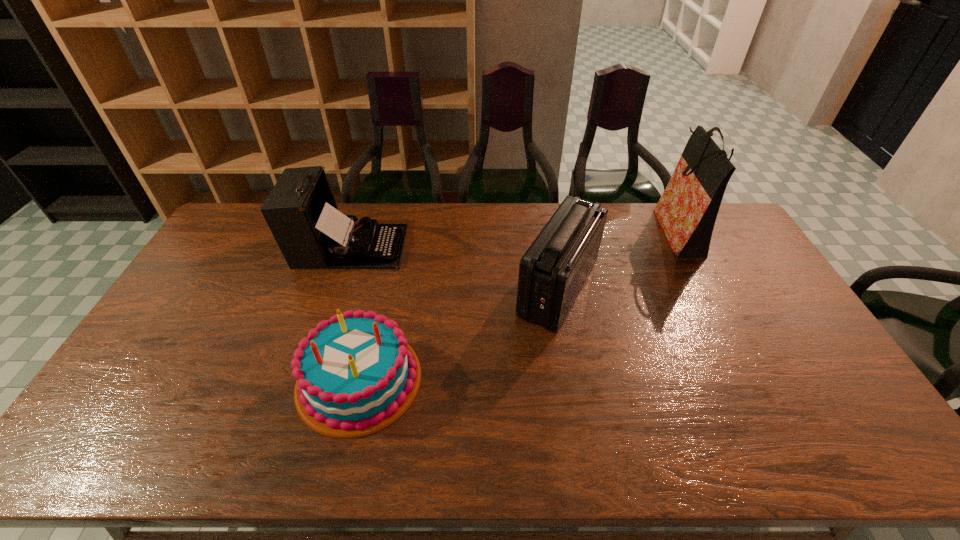
Where is `free space that satisfies the following two spatial constraints: 1. on the front panel of the third object from left to right; 2. on the front side of the shortest object`? Image resolution: width=960 pixels, height=540 pixels. free space that satisfies the following two spatial constraints: 1. on the front panel of the third object from left to right; 2. on the front side of the shortest object is located at coordinates (574, 380).

I want to click on vacant position in the image that satisfies the following two spatial constraints: 1. on the back side of the shortest object; 2. inside the open case of the typewriter, so click(x=390, y=246).

What are the coordinates of `free space that satisfies the following two spatial constraints: 1. inside the open case of the typewriter; 2. on the right side of the shortest object` in the screenshot? It's located at (306, 380).

You are a GUI agent. You are given a task and a screenshot of the screen. Output one action in this format:
    pyautogui.click(x=<x>, y=<y>)
    Task: Click on the vacant space that satisfies the following two spatial constraints: 1. inside the open case of the shortest object; 2. on the right side of the typewriter
    
    Given the screenshot: What is the action you would take?
    pyautogui.click(x=306, y=380)